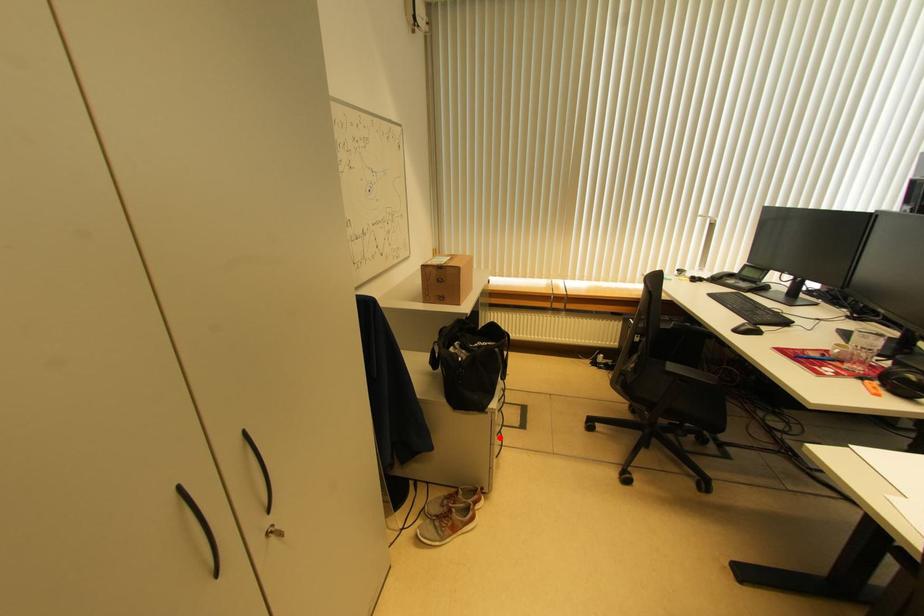
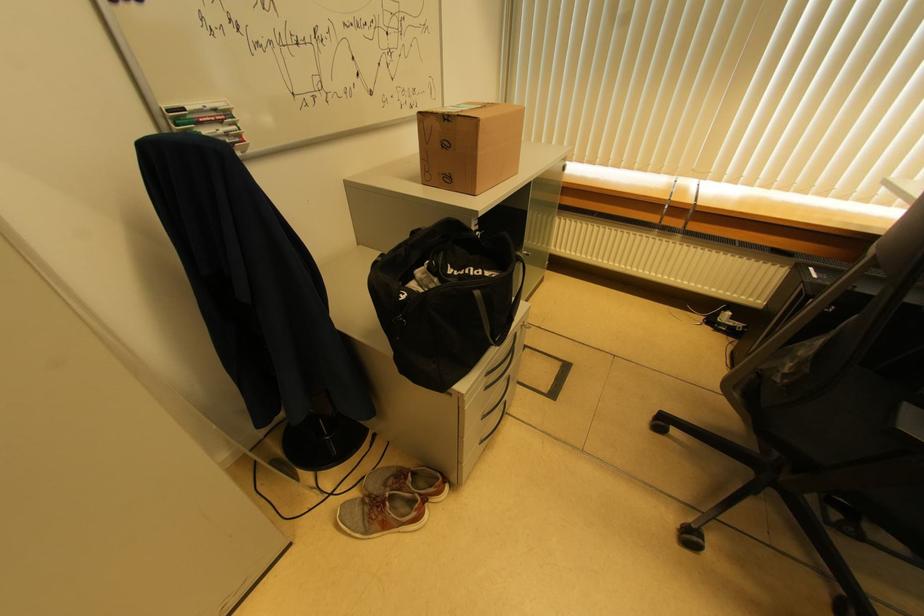
Question: I am providing you with two images of the same scene from different viewpoints. A red point is shown in image1. For the corresponding object point in image2, is it positioned nearer or farther from the camera?

Choices:
 (A) Nearer
 (B) Farther

Answer: (A)